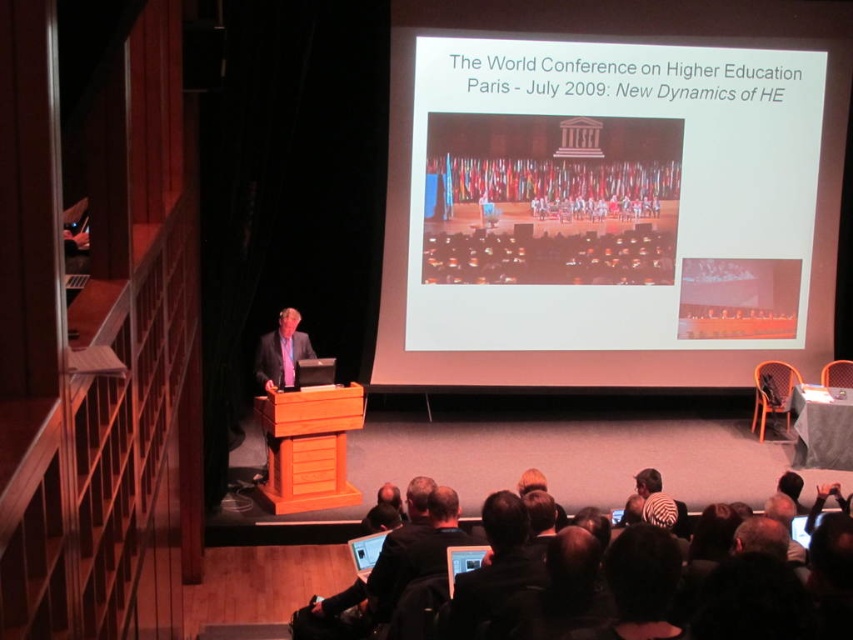
Is matte black screen at center to the left of matte black laptop at lower center from the viewer's perspective?

No, matte black screen at center is not to the left of matte black laptop at lower center.

Does matte black screen at center have a greater height compared to matte black laptop at lower center?

In fact, matte black screen at center may be shorter than matte black laptop at lower center.

Describe the element at coordinates (463, 561) in the screenshot. I see `matte black screen at center` at that location.

Identify the location of matte black screen at center. (463, 561).

Does point (456, 580) come in front of point (320, 492)?

Yes, point (456, 580) is in front of point (320, 492).

Is point (833, 554) in front of point (354, 428)?

That is True.

Where is `black leather jacket at lower center`? Image resolution: width=853 pixels, height=640 pixels. black leather jacket at lower center is located at coordinates (831, 561).

Which is more to the left, wooden podium at center or matte black laptop at lower center?

From the viewer's perspective, wooden podium at center appears more on the left side.

Between point (265, 500) and point (366, 544), which one is positioned in front?

Point (366, 544) is in front.

Identify the location of wooden podium at center. (309, 445).